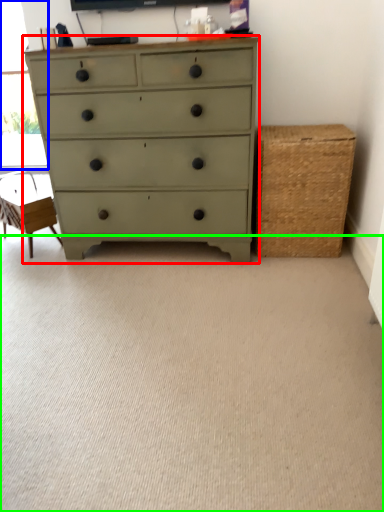
Question: Which object is positioned closest to chest of drawers (highlighted by a red box)? Select from window screen (highlighted by a blue box) and plain (highlighted by a green box).

Choices:
 (A) window screen
 (B) plain

Answer: (B)